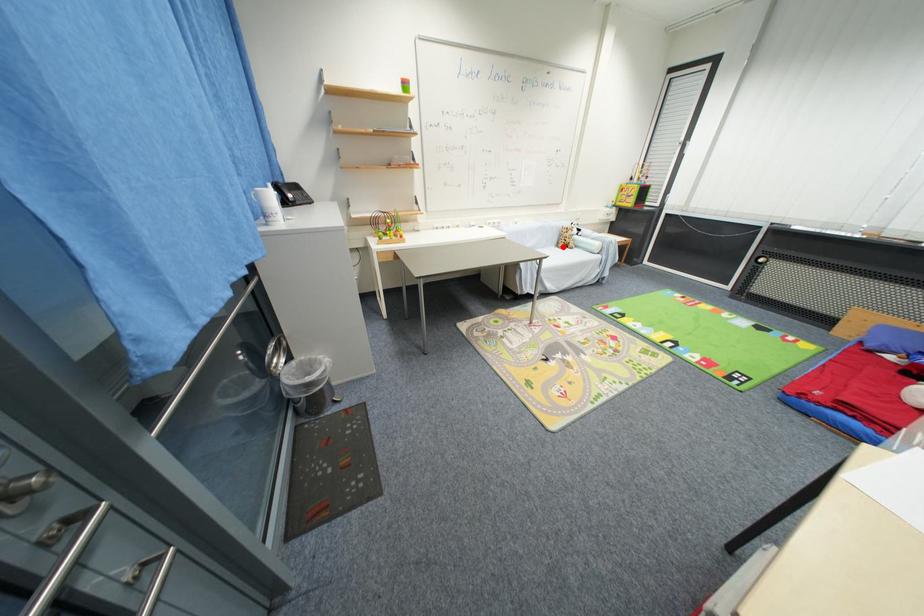
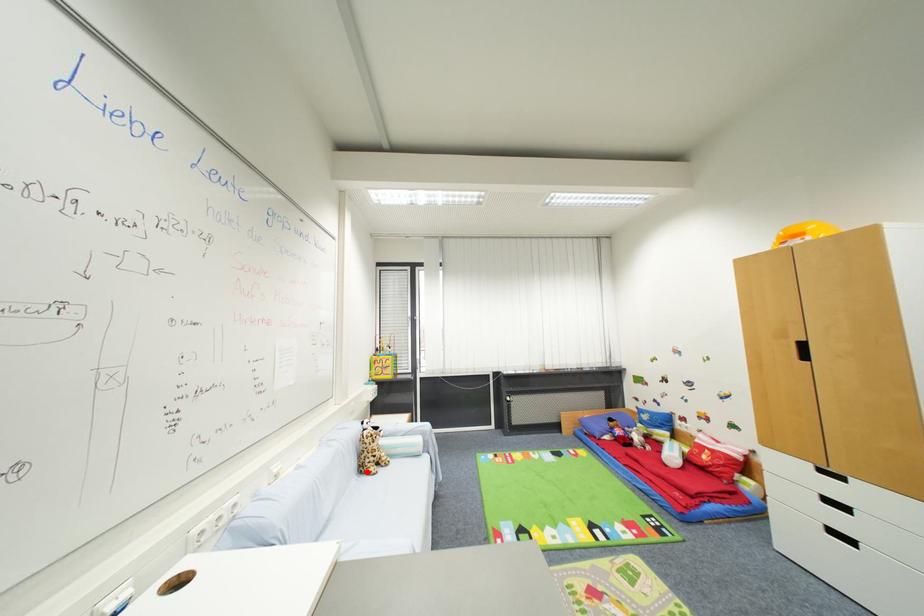
I am providing you with two images of the same scene from different viewpoints. A red point is marked on the first image and another point is marked on the second image. Is the marked point in image1 the same physical position as the marked point in image2?

Yes